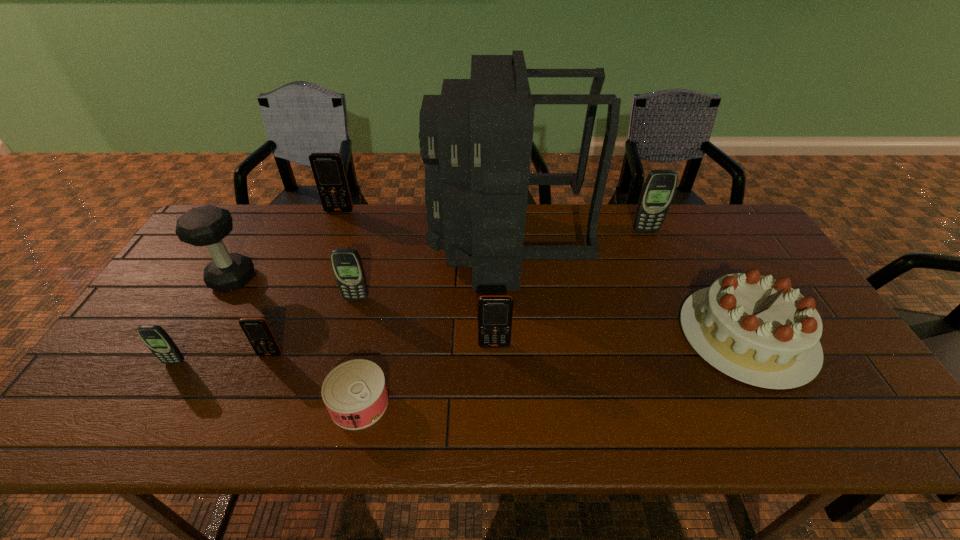
Find the location of a particular element. The height and width of the screenshot is (540, 960). object that is at the near edge is located at coordinates [355, 393].

Locate an element on the screen. dumbbell located at the left edge is located at coordinates (206, 226).

The height and width of the screenshot is (540, 960). In order to click on cellular telephone that is at the left edge in this screenshot , I will do `click(155, 337)`.

I want to click on object positioned at the right edge, so click(x=758, y=330).

The width and height of the screenshot is (960, 540). What are the coordinates of `vacant space at the far edge` in the screenshot? It's located at (697, 232).

The height and width of the screenshot is (540, 960). In order to click on free space at the near edge of the desktop in this screenshot , I will do `click(177, 431)`.

This screenshot has height=540, width=960. In the image, there is a desktop. Find the location of `vacant region at the left edge`. vacant region at the left edge is located at coordinates (180, 271).

You are a GUI agent. You are given a task and a screenshot of the screen. Output one action in this format:
    pyautogui.click(x=<x>, y=<y>)
    Task: Click on the vacant space at the right edge of the desktop
    The image size is (960, 540).
    Given the screenshot: What is the action you would take?
    pyautogui.click(x=826, y=353)

Locate an element on the screen. blank space at the far right corner of the desktop is located at coordinates (720, 217).

This screenshot has height=540, width=960. I want to click on free space between the dumbbell and the leftmost cellular telephone, so click(x=204, y=321).